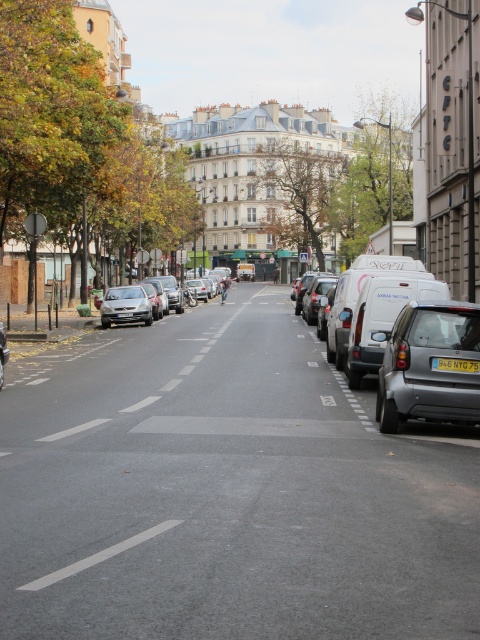
Question: Does white matte van at right have a greater width compared to silver metallic hatchback at left?

Choices:
 (A) no
 (B) yes

Answer: (B)

Question: Is white matte van at right above silver metallic hatchback at left?

Choices:
 (A) yes
 (B) no

Answer: (A)

Question: Based on their relative distances, which object is farther from the white glossy line at center?

Choices:
 (A) silver metallic car at center
 (B) white matte van at right
 (C) yellow plastic license plate at center

Answer: (A)

Question: Which object appears closest to the camera in this image?

Choices:
 (A) matte gray suv at right
 (B) white matte van at right

Answer: (A)

Question: Considering the real-world distances, which object is farthest from the matte gray suv at right?

Choices:
 (A) yellow plastic license plate at center
 (B) silver metallic car at center
 (C) white matte van at right
 (D) silver metallic hatchback at left

Answer: (B)

Question: Is matte gray suv at right above white matte van at right?

Choices:
 (A) yes
 (B) no

Answer: (B)